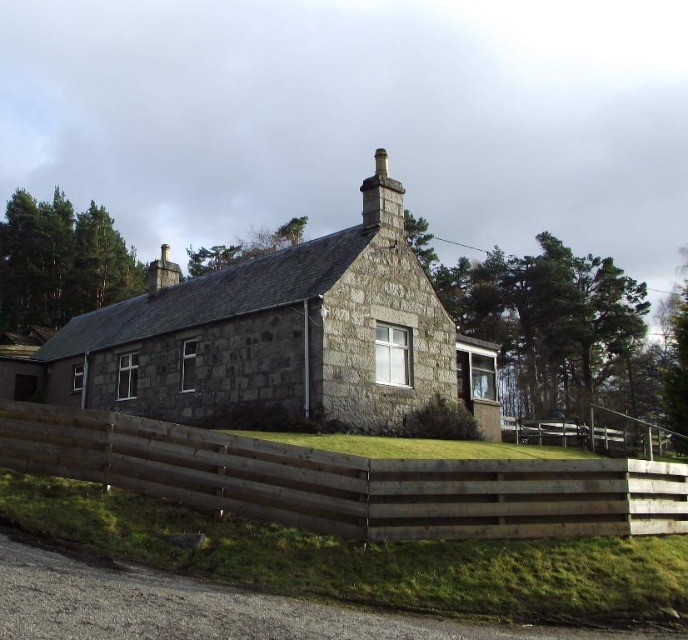
Question: Does gray stone cottage at center have a larger size compared to brown wooden fence at lower center?

Choices:
 (A) no
 (B) yes

Answer: (B)

Question: From the image, what is the correct spatial relationship of gray stone cottage at center in relation to gray stone chimney at upper center?

Choices:
 (A) right
 (B) left

Answer: (B)

Question: Is gray stone cottage at center below brown wooden fence at lower center?

Choices:
 (A) no
 (B) yes

Answer: (A)

Question: Which point is closer to the camera?

Choices:
 (A) (105, 404)
 (B) (292, 502)
 (C) (394, 214)

Answer: (B)

Question: Which of the following is the closest to the observer?

Choices:
 (A) gray stone cottage at center
 (B) brown wooden fence at lower center
 (C) gray stone chimney at upper center

Answer: (B)

Question: Which object is positioned farthest from the gray stone chimney at upper center?

Choices:
 (A) gray stone cottage at center
 (B) brown wooden fence at lower center

Answer: (B)